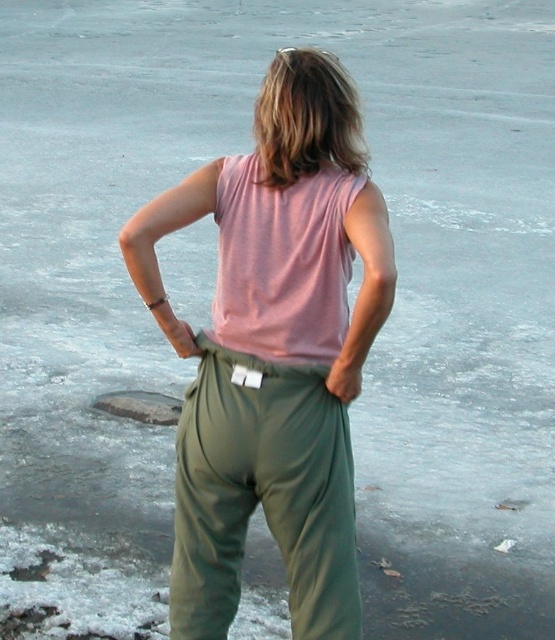
Is matte pink tank top at center wider than olive green fabric pants at center?

Yes.

This screenshot has width=555, height=640. Identify the location of matte pink tank top at center. (274, 349).